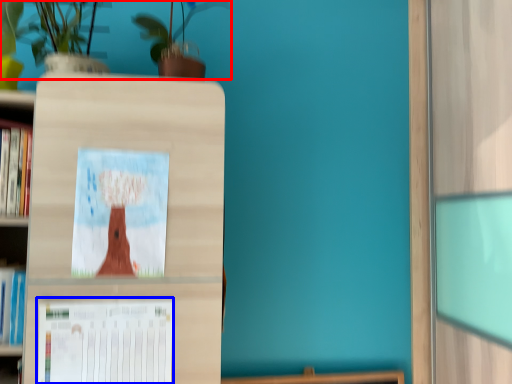
Question: Among these objects, which one is farthest to the camera, floral arrangement (highlighted by a red box) or paperback book (highlighted by a blue box)?

Choices:
 (A) floral arrangement
 (B) paperback book

Answer: (B)